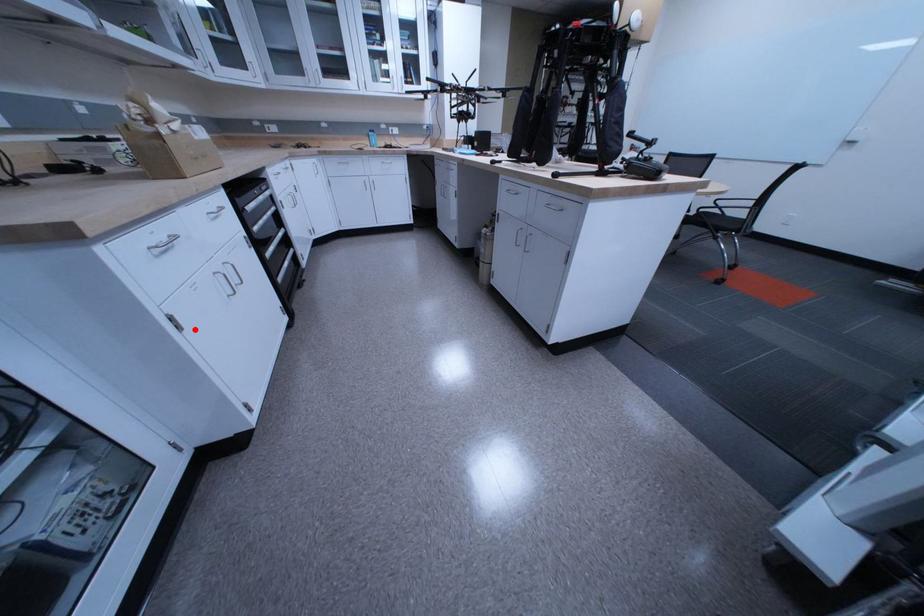
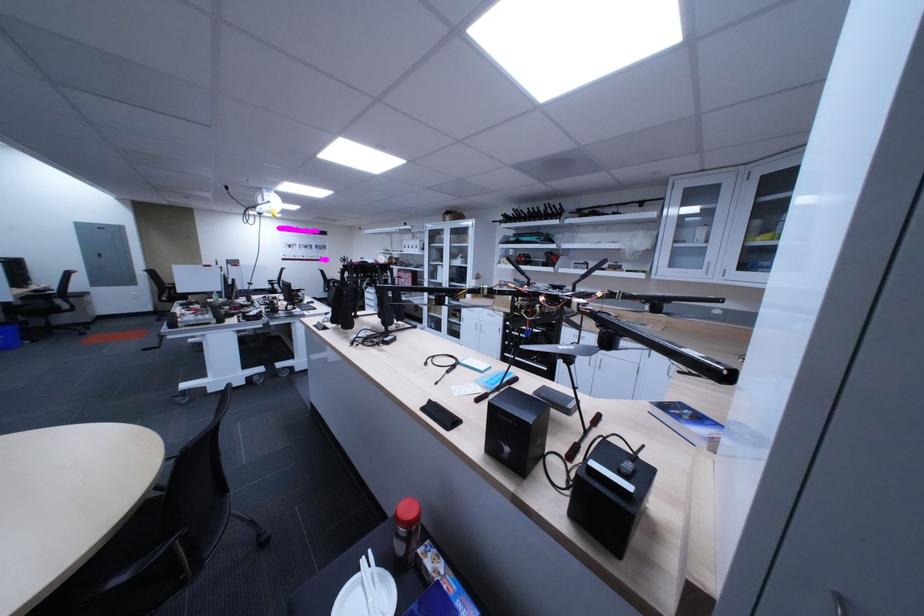
Question: I am providing you with two images of the same scene from different viewpoints. Image1 has a red point marked. In image2, the corresponding 3D location appears at what relative position? Reply with the corresponding letter.

Choices:
 (A) Closer
 (B) Farther

Answer: (B)